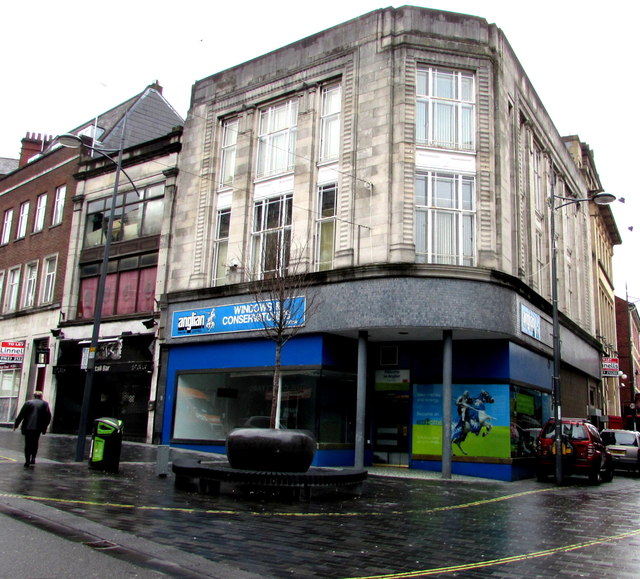
Locate an element on the screen. This screenshot has width=640, height=579. rubbish bin is located at coordinates (102, 455).